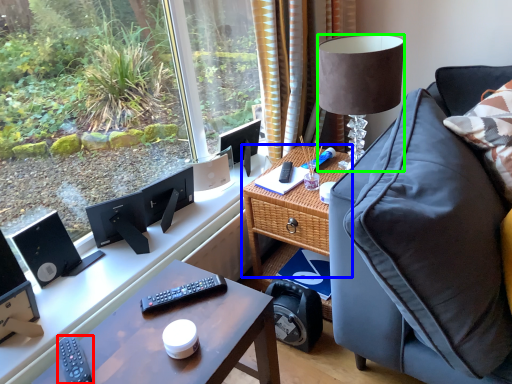
Question: Estimate the real-world distances between objects in this image. Which object is farther from remote control (highlighted by a red box), table (highlighted by a blue box) or lamp (highlighted by a green box)?

Choices:
 (A) table
 (B) lamp

Answer: (B)